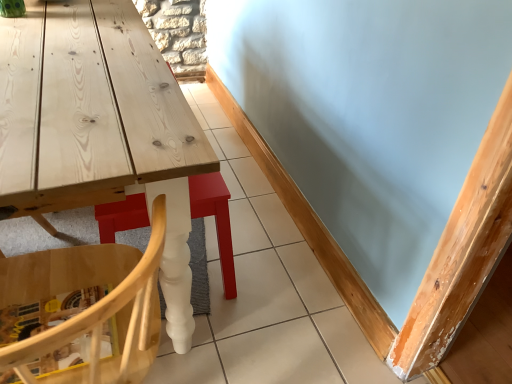
What do you see at coordinates (99, 126) in the screenshot?
I see `natural wood table at lower left` at bounding box center [99, 126].

Where is `natural wood table at lower left`? The height and width of the screenshot is (384, 512). natural wood table at lower left is located at coordinates (99, 126).

Identify the location of natural wood table at lower left. (99, 126).